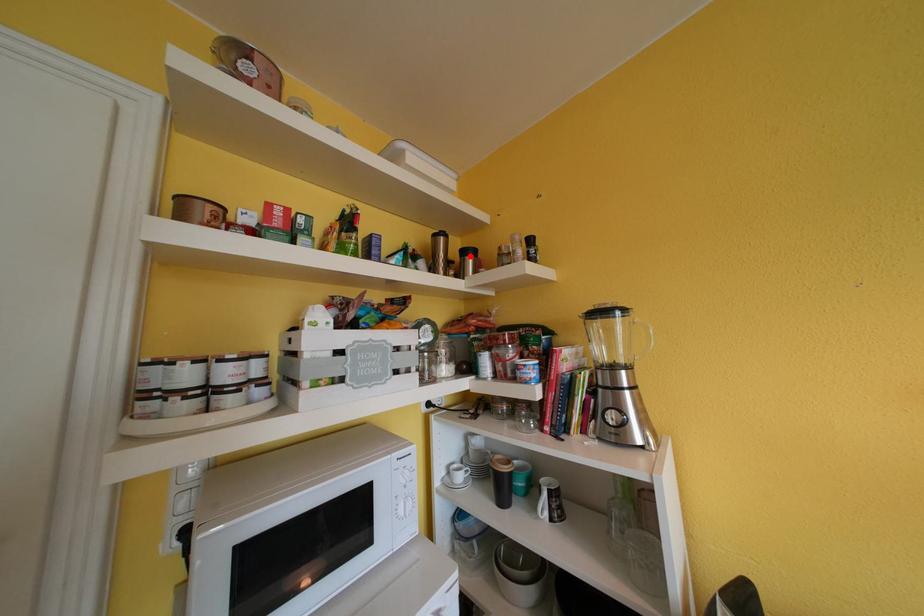
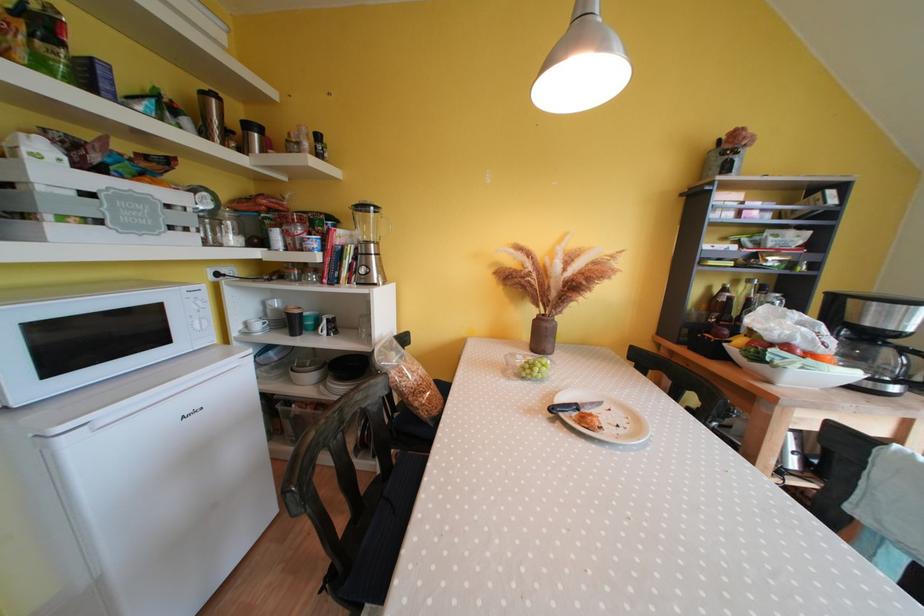
Find the pixel in the second image that matches the highlighted location in the first image.

(252, 130)